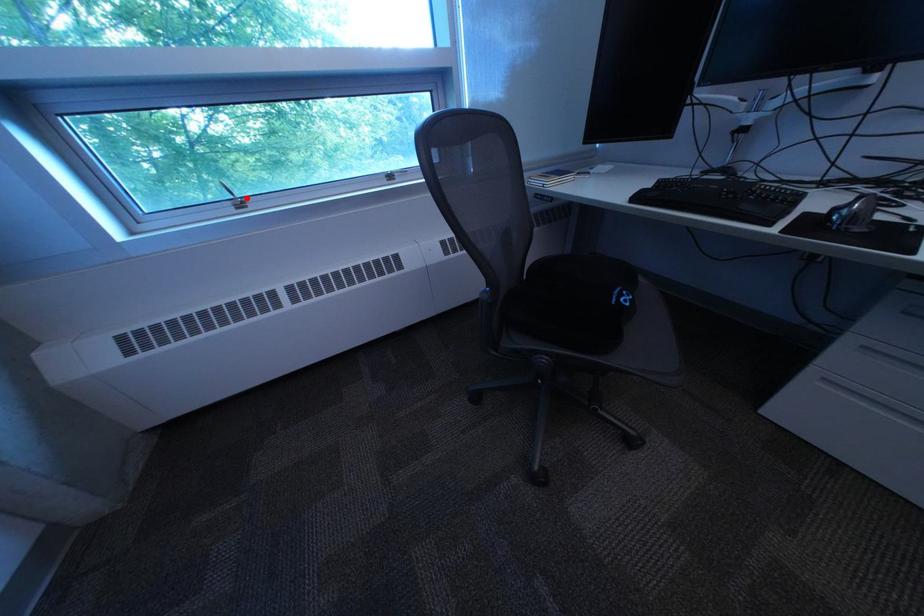
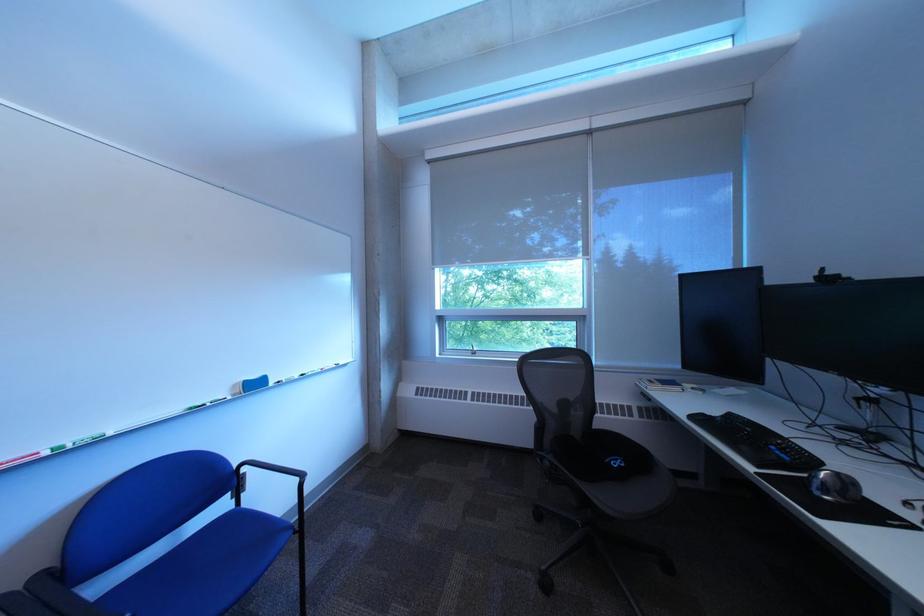
Question: A red point is marked in image1. In image2, is the corresponding 3D point closer to the camera or farther? Reply with the corresponding letter.

Choices:
 (A) The corresponding 3D point is closer.
 (B) The corresponding 3D point is farther.

Answer: (A)